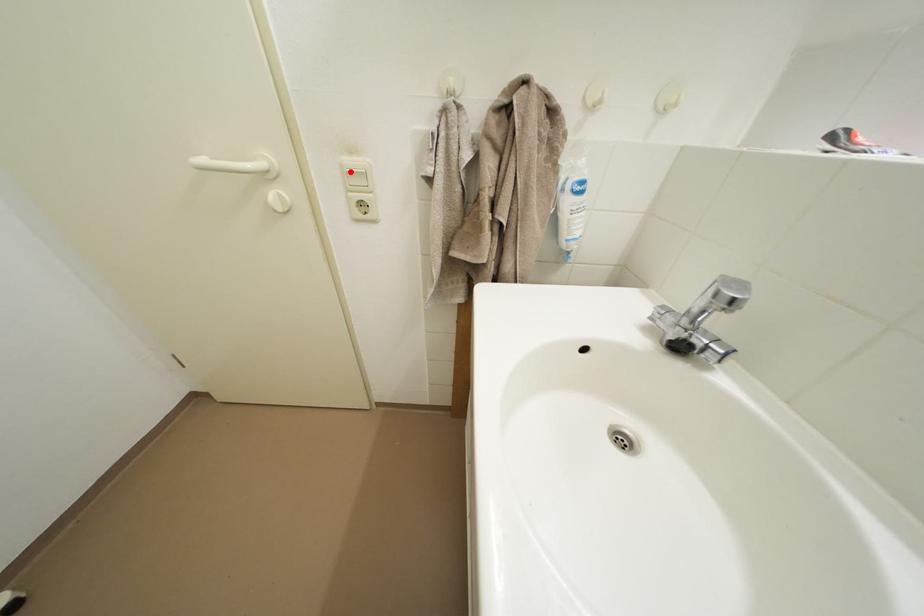
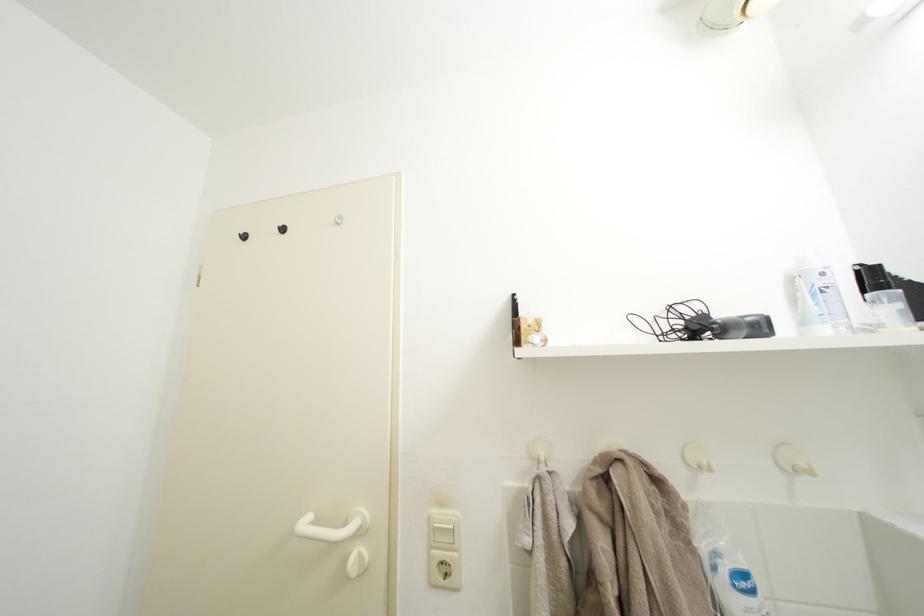
Find the pixel in the second image that matches the highlighted location in the first image.

(438, 525)